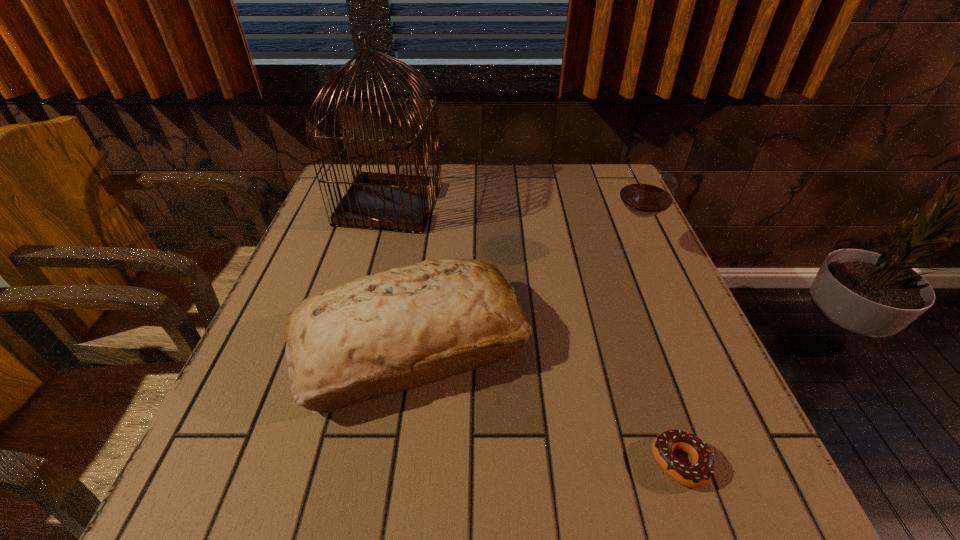
What are the coordinates of `vacant space at the far edge of the desktop` in the screenshot? It's located at (527, 165).

In the image, there is a desktop. Where is `free space at the near edge`? This screenshot has width=960, height=540. free space at the near edge is located at coordinates (490, 477).

In the image, there is a desktop. Identify the location of free region at the left edge. Image resolution: width=960 pixels, height=540 pixels. (285, 347).

Find the location of a particular element. This screenshot has width=960, height=540. vacant space at the right edge is located at coordinates (665, 272).

Locate an element on the screen. This screenshot has height=540, width=960. vacant space at the far left corner of the desktop is located at coordinates (383, 166).

In the image, there is a desktop. At what (x,y) coordinates should I click in order to perform the action: click on vacant space at the far right corner. Please return your answer as a coordinate pair (x, y). This screenshot has height=540, width=960. Looking at the image, I should click on (578, 185).

Find the location of a particular element. vacant area that lies between the doughnut and the farthest object is located at coordinates (535, 334).

The height and width of the screenshot is (540, 960). I want to click on free spot between the doughnut and the wineglass, so click(656, 357).

I want to click on free spot between the shortest object and the second shortest object, so 545,404.

Where is `unoccupied position between the third farthest object and the doughnut`? Image resolution: width=960 pixels, height=540 pixels. unoccupied position between the third farthest object and the doughnut is located at coordinates (545, 404).